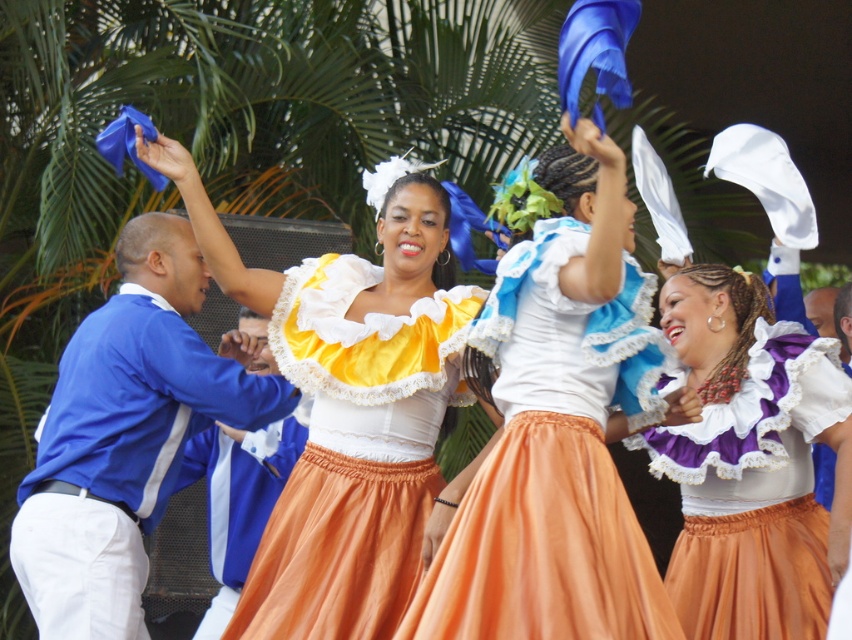
Identify the location of yellow satin blouse at center. (346, 412).

Does yellow satin blouse at center appear under blue satin jacket at left?

No.

At what (x,y) coordinates should I click in order to perform the action: click on yellow satin blouse at center. Please return your answer as a coordinate pair (x, y). This screenshot has height=640, width=852. Looking at the image, I should click on (346, 412).

Is point (444, 636) closer to camera compared to point (111, 602)?

Yes, point (444, 636) is in front of point (111, 602).

Who is positioned more to the left, matte orange skirt at center or blue satin jacket at left?

Positioned to the left is blue satin jacket at left.

In order to click on matte orange skirt at center in this screenshot , I will do `click(557, 429)`.

Is matte orange skirt at center positioned before yellow satin blouse at center?

Yes, matte orange skirt at center is in front of yellow satin blouse at center.

You are a GUI agent. You are given a task and a screenshot of the screen. Output one action in this format:
    pyautogui.click(x=<x>, y=<y>)
    Task: Click on the matte orange skirt at center
    The image size is (852, 640).
    Given the screenshot: What is the action you would take?
    pyautogui.click(x=557, y=429)

Where is `matte orange skirt at center`? matte orange skirt at center is located at coordinates (557, 429).